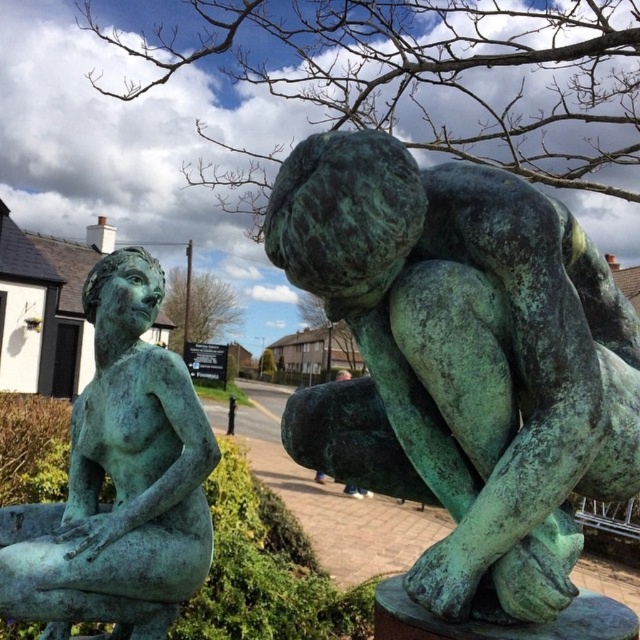
You are an art conservator assessing the placement of two green patina statues in an outdoor setting. The statues are labeled as the green patina statue at center and the green patina statue at left. Based on their positions, which statue would be more exposed to rainwater runoff from the roof of a nearby building? Please explain your reasoning.

The green patina statue at center is above the green patina statue at left. Since it is positioned higher, rainwater runoff from the nearby building would flow downward, potentially making the lower statue at left more exposed to the runoff.

You are standing in front of the two bronze sculptures. You want to take a photo that includes both sculptures but focuses on the point at coordinates point (353,241). Can you estimate if the point is close enough to be in focus if your camera has a depth of field that can sharply focus objects within 1.5 meters range?

The point (353,241) is 1.21 meters from the camera. Since the depth of field can focus within 1.5 meters, the point is within the range and should be in focus.

From the picture: You are a tour guide explaining the spacing between the two green patina statues. How far apart are the green patina statue at center and the green patina statue at left?

The green patina statue at center is 3.61 feet from the green patina statue at left.